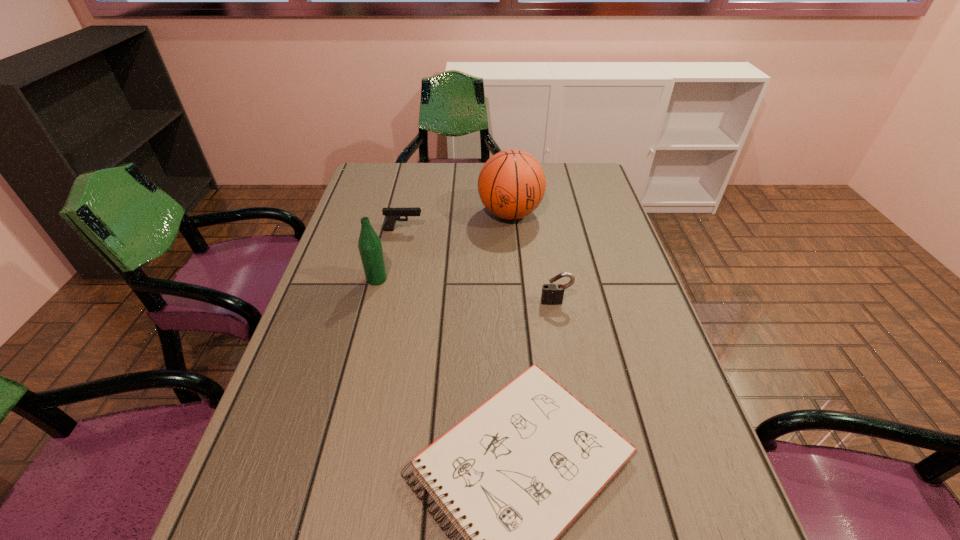
Locate an element on the screen. The width and height of the screenshot is (960, 540). bottle that is at the left edge is located at coordinates (370, 247).

Find the location of a particular element. Image resolution: width=960 pixels, height=540 pixels. pistol present at the left edge is located at coordinates tap(392, 214).

Where is `free location at the far edge of the desktop`? free location at the far edge of the desktop is located at coordinates (469, 179).

Identify the location of free spot at the left edge of the desktop. (382, 198).

Locate an element on the screen. The image size is (960, 540). free space at the right edge is located at coordinates (633, 352).

The height and width of the screenshot is (540, 960). In the image, there is a desktop. Identify the location of vacant space at the far left corner. (390, 180).

In the image, there is a desktop. Where is `vacant space at the far right corner`? This screenshot has height=540, width=960. vacant space at the far right corner is located at coordinates (599, 192).

Locate an element on the screen. The height and width of the screenshot is (540, 960). free space between the padlock and the third farthest object is located at coordinates (467, 291).

Locate an element on the screen. The height and width of the screenshot is (540, 960). vacant area that lies between the basketball and the third tallest object is located at coordinates click(533, 258).

The width and height of the screenshot is (960, 540). Find the location of `empty space between the basketball and the third tallest object`. empty space between the basketball and the third tallest object is located at coordinates (533, 258).